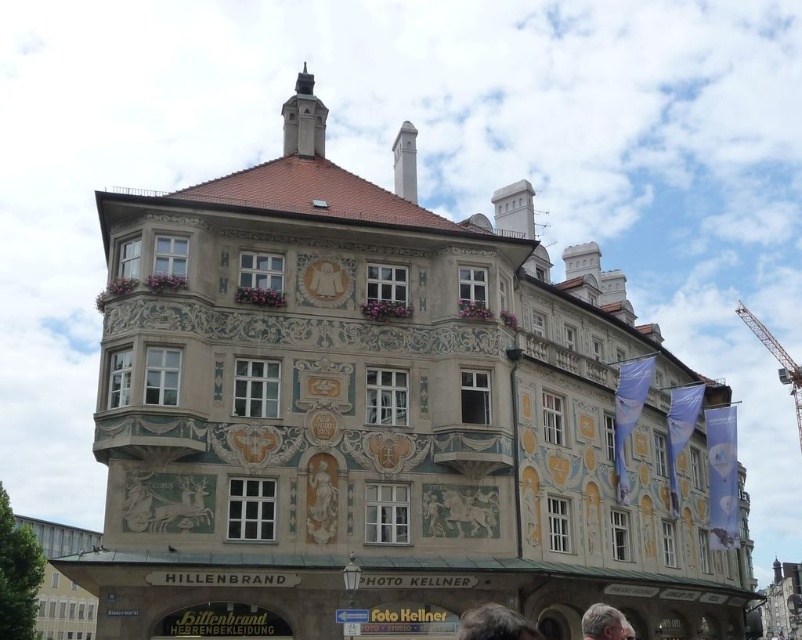
Question: Is metallic gray crane at upper right to the right of gray hair at lower right from the viewer's perspective?

Choices:
 (A) no
 (B) yes

Answer: (B)

Question: Is white marble statue at center positioned before gray hair at lower right?

Choices:
 (A) yes
 (B) no

Answer: (B)

Question: Which object appears farthest from the camera in this image?

Choices:
 (A) white marble statue at center
 (B) metallic gray crane at upper right
 (C) gray hair at lower right

Answer: (B)

Question: Estimate the real-world distances between objects in this image. Which object is closer to the gray hair at lower right?

Choices:
 (A) gray hair at lower center
 (B) white marble statue at center
 (C) metallic gray crane at upper right

Answer: (A)

Question: Among these objects, which one is farthest from the camera?

Choices:
 (A) gray hair at lower center
 (B) gray hair at lower right
 (C) metallic gray crane at upper right
 (D) white marble statue at center

Answer: (C)

Question: Is gray hair at lower center to the left of metallic gray crane at upper right from the viewer's perspective?

Choices:
 (A) no
 (B) yes

Answer: (B)